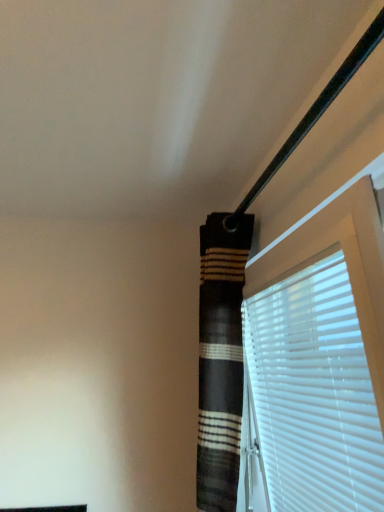
Describe the element at coordinates (314, 392) in the screenshot. This screenshot has width=384, height=512. I see `white plastic blinds at upper right` at that location.

Find the location of `white plastic blinds at upper right`. white plastic blinds at upper right is located at coordinates (314, 392).

The height and width of the screenshot is (512, 384). In order to click on white plastic blinds at upper right in this screenshot , I will do `click(314, 392)`.